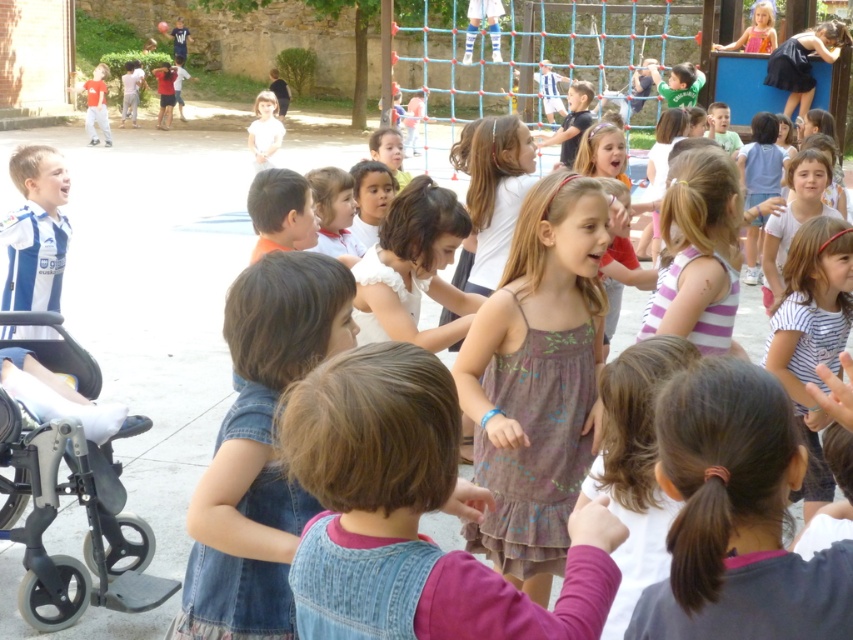
Who is more forward, (x=514, y=346) or (x=28, y=465)?

Point (x=514, y=346) is in front.

Describe the element at coordinates (537, 380) in the screenshot. I see `brown textured dress at center` at that location.

Identify the location of brown textured dress at center. The image size is (853, 640). (537, 380).

Is gray metallic baby carriage at lower left above pink fabric dress at upper right?

No.

This screenshot has height=640, width=853. Describe the element at coordinates (86, 532) in the screenshot. I see `gray metallic baby carriage at lower left` at that location.

Where is `gray metallic baby carriage at lower left`? gray metallic baby carriage at lower left is located at coordinates (86, 532).

Which is more to the right, brown textured dress at center or pink fabric dress at upper right?

pink fabric dress at upper right is more to the right.

Who is more forward, (500, 483) or (764, 33)?

Positioned in front is point (500, 483).

Who is more forward, (473, 387) or (762, 42)?

Point (473, 387) is more forward.

The width and height of the screenshot is (853, 640). What are the coordinates of `brown textured dress at center` in the screenshot? It's located at (537, 380).